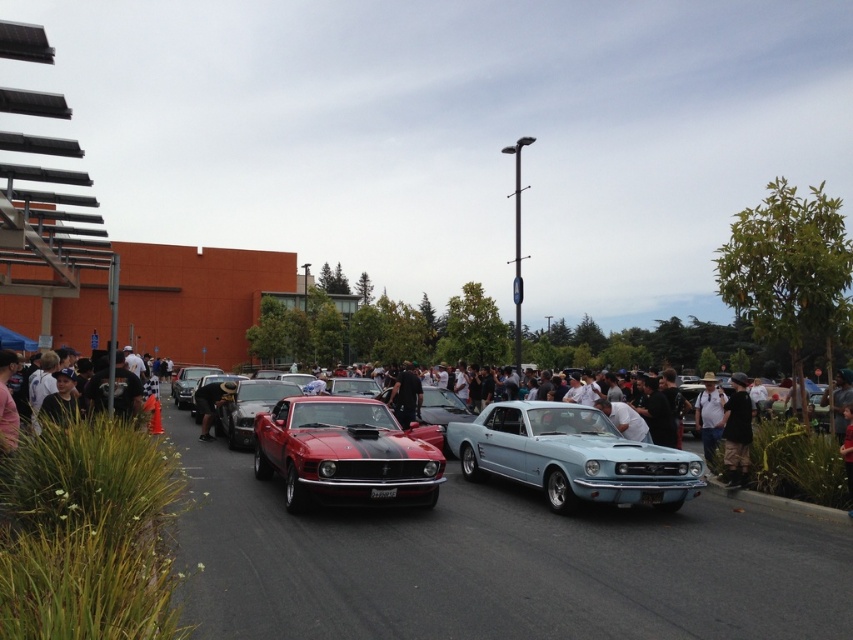
You are a photographer standing at the back of the car show. You want to take a photo of both the light blue metallic car at center and the shiny red muscle car at center. Which car should you focus on first if you want to capture both in the frame without moving your camera?

The light blue metallic car at center is located below the shiny red muscle car at center, so you should focus on the shiny red muscle car at center first to ensure both are in the frame.

You are a photographer standing at the edge of the car show. You want to take a photo of both the light blue metallic car at center and the shiny black sedan at center without any obstructions. Based on their positions, which car should you focus on first to ensure both are fully visible in the frame?

The light blue metallic car at center is in front of the shiny black sedan at center. To ensure both are fully visible, focus on the shiny black sedan at center first, as it is behind the light blue one and might be partially obscured if not properly framed.

You are a photographer at the car show and want to take a picture of both the shiny red car at center and the dark brown leather jacket at center. Since you can only focus on one object at a time, which one should you aim your camera at first to ensure the other is still in the frame?

You should aim your camera at the shiny red car at center first because it is positioned to the left of the dark brown leather jacket at center, so if you focus on the leftmost object, the right side of the frame will still include the dark brown leather jacket at center.